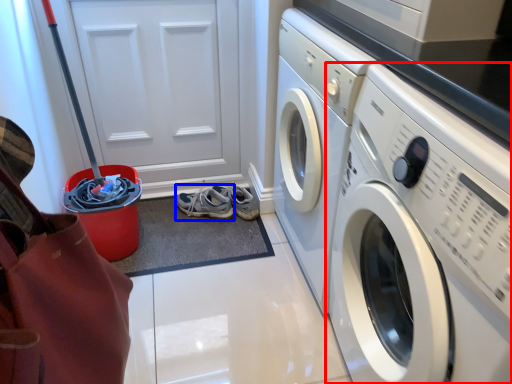
Question: Which point is further to the camera, washing machine (highlighted by a red box) or running shoe (highlighted by a blue box)?

Choices:
 (A) washing machine
 (B) running shoe

Answer: (B)